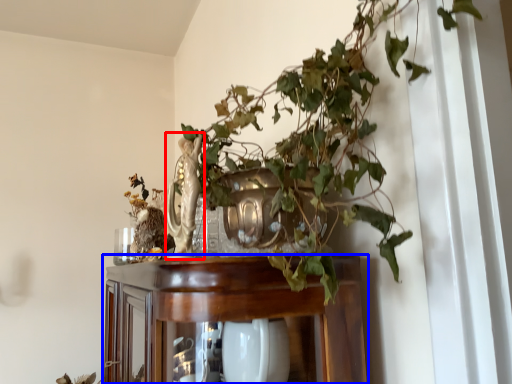
Question: Which of the following is the closest to the observer, sculpture (highlighted by a red box) or furniture (highlighted by a blue box)?

Choices:
 (A) sculpture
 (B) furniture

Answer: (B)